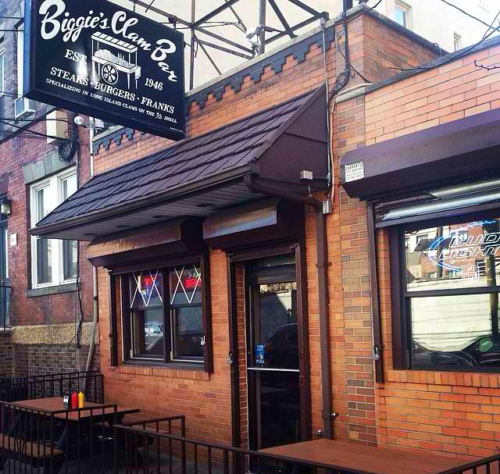
Image resolution: width=500 pixels, height=474 pixels. I want to click on bud light sign, so click(493, 245).